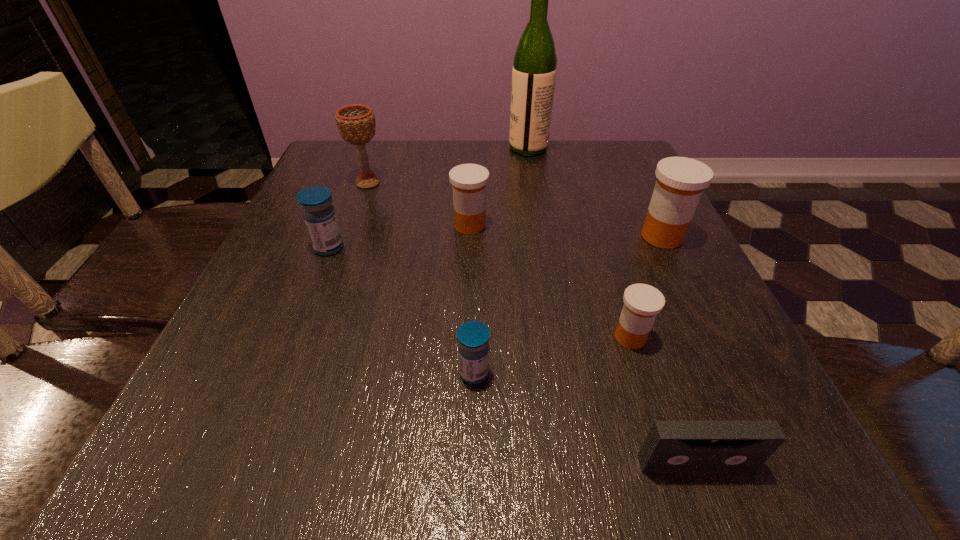
The height and width of the screenshot is (540, 960). I want to click on free space located 0.240m on the label of the tallest medicine, so click(x=518, y=237).

The image size is (960, 540). What are the coordinates of `free region located 0.280m on the label of the second smallest orange medicine` in the screenshot? It's located at (624, 225).

I want to click on blank area located 0.130m on the right of the bigger blue medicine, so click(411, 248).

Where is `blank space located on the label of the second nearest medicine`? The image size is (960, 540). blank space located on the label of the second nearest medicine is located at coordinates (498, 338).

Identify the location of blank space located 0.350m on the label of the second nearest medicine. The height and width of the screenshot is (540, 960). (390, 338).

You are a GUI agent. You are given a task and a screenshot of the screen. Output one action in this format:
    pyautogui.click(x=<x>, y=<y>)
    Task: Click on the vacant space situated 0.160m on the label of the second nearest medicine
    The image size is (960, 540).
    Given the screenshot: What is the action you would take?
    pyautogui.click(x=511, y=338)

The width and height of the screenshot is (960, 540). Find the location of `free region located 0.110m on the front of the smaller blue medicine`. free region located 0.110m on the front of the smaller blue medicine is located at coordinates (473, 462).

Where is `liquor that is positioned at the far edge`? This screenshot has width=960, height=540. liquor that is positioned at the far edge is located at coordinates (534, 69).

At what (x,y) coordinates should I click in order to perform the action: click on chalice that is at the far edge. Please return your answer as a coordinate pair (x, y). Looking at the image, I should click on (356, 123).

The image size is (960, 540). What are the coordinates of `object that is at the near edge` in the screenshot? It's located at (671, 446).